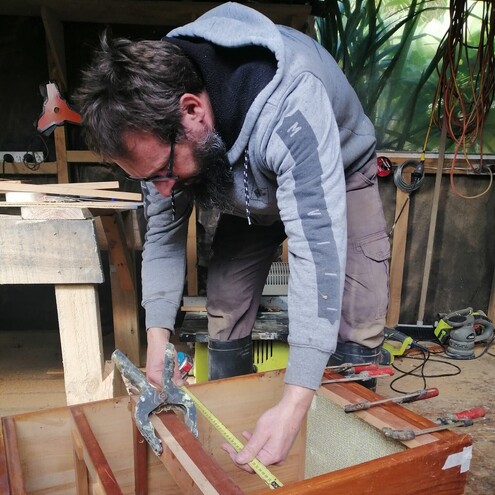
You are a GUI agent. You are given a task and a screenshot of the screen. Output one action in this format:
    pyautogui.click(x=<x>, y=<y>)
    Task: Click on the floor
    The image size is (495, 495).
    Given the screenshot: What is the action you would take?
    pyautogui.click(x=454, y=384)